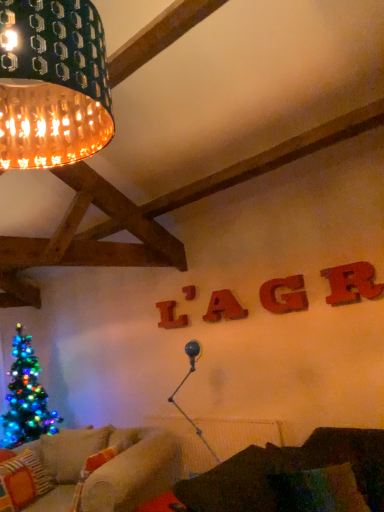
At what (x,y) coordinates should I click in order to perform the action: click on velvet red letter g at center, which is the fourth letter from back to front. Please return your answer as a coordinate pair (x, y). This screenshot has height=512, width=384. Looking at the image, I should click on (284, 295).

Image resolution: width=384 pixels, height=512 pixels. What do you see at coordinates (189, 292) in the screenshot?
I see `wooden letter at upper center, the fourth letter in the front-to-back sequence` at bounding box center [189, 292].

Where is `knitted wool pillow at lower left`? This screenshot has height=512, width=384. knitted wool pillow at lower left is located at coordinates (24, 479).

Image resolution: width=384 pixels, height=512 pixels. In order to click on matte gold lampshade at upper left in this screenshot , I will do `click(52, 83)`.

Identify the location of velvet dark brown couch at lower right. (290, 478).

In order to face wooden letter at center, which appears as the fifth letter when viewed from the right, should I rotate leftwards or rightwards?

→ You should rotate left by 2.874 degrees.

Measure the distance between point (363, 297) and camera.

They are 2.56 meters apart.

I want to click on velvet red letter g at center, arranged as the 2th letter when viewed from the front, so click(x=284, y=295).

From the image's perspective, starting from the knitted wool pillow at lower left, which letter is the 5th one above? Please provide its 2D coordinates.

[(352, 283)]

How many degrees apart are the facing directions of wooden letter at upper right, acting as the 5th letter starting from the back, and knitted wool pillow at lower left?

The angular difference between wooden letter at upper right, acting as the 5th letter starting from the back, and knitted wool pillow at lower left is 101 degrees.

Is wooden letter at upper right, acting as the 1th letter starting from the right, at the right side of knitted wool pillow at lower left?

Correct, you'll find wooden letter at upper right, acting as the 1th letter starting from the right, to the right of knitted wool pillow at lower left.

From a real-world perspective, is wooden letter at upper right, positioned as the fifth letter in left-to-right order, beneath knitted wool pillow at lower left?

No, from a real-world perspective, wooden letter at upper right, positioned as the fifth letter in left-to-right order, is not below knitted wool pillow at lower left.

Which object is further away from the camera, wooden letter at upper right, the first letter in the front-to-back sequence, or wooden letter at center, the 1th letter viewed from the left?

wooden letter at center, the 1th letter viewed from the left, is further away from the camera.

Looking at this image, which of these two, wooden letter at upper right, the first letter in the front-to-back sequence, or wooden letter at center, the 1th letter viewed from the back, is thinner?

With smaller width is wooden letter at center, the 1th letter viewed from the back.

Is wooden letter at upper right, acting as the 5th letter starting from the back, taller or shorter than wooden letter at center, the fifth letter viewed from the front?

In the image, wooden letter at upper right, acting as the 5th letter starting from the back, appears to be shorter than wooden letter at center, the fifth letter viewed from the front.

Is the surface of wooden letter at upper right, acting as the 1th letter starting from the right, in direct contact with wooden letter at center, the fifth letter viewed from the front?

No, wooden letter at upper right, acting as the 1th letter starting from the right, is not with wooden letter at center, the fifth letter viewed from the front.

Image resolution: width=384 pixels, height=512 pixels. I want to click on the 2nd letter positioned below the matte gold lampshade at upper left (from the image's perspective), so click(284, 295).

Visually, is velvet red letter g at center, which is the fourth letter from back to front, positioned to the left or to the right of matte gold lampshade at upper left?

velvet red letter g at center, which is the fourth letter from back to front, is to the right of matte gold lampshade at upper left.

Is velvet red letter g at center, which is the fourth letter from back to front, bigger than matte gold lampshade at upper left?

Incorrect, velvet red letter g at center, which is the fourth letter from back to front, is not larger than matte gold lampshade at upper left.

From a real-world perspective, which object rests below the other?

velvet red letter g at center, placed as the second letter when sorted from right to left, from a real-world perspective.

Can you confirm if velvet dark brown couch at lower right is shorter than wooden letter at upper center, marked as the 3th letter in a front-to-back arrangement?

Incorrect, the height of velvet dark brown couch at lower right does not fall short of that of wooden letter at upper center, marked as the 3th letter in a front-to-back arrangement.

Is point (361, 435) farther from camera compared to point (211, 297)?

No.

Find the location of `letter that is the 3rd one when counting backward from the velvet dark brown couch at lower right`. letter that is the 3rd one when counting backward from the velvet dark brown couch at lower right is located at coordinates (224, 307).

From the picture: Which object is positioned more to the right, velvet dark brown couch at lower right or wooden letter at upper center, the 3th letter positioned from the left?

From the viewer's perspective, velvet dark brown couch at lower right appears more on the right side.

Is wooden letter at upper center, the fourth letter in the front-to-back sequence, taller than velvet dark brown couch at lower right?

In fact, wooden letter at upper center, the fourth letter in the front-to-back sequence, may be shorter than velvet dark brown couch at lower right.

Which is nearer, (191, 293) or (194, 509)?

Point (194, 509)

Which object is closer to the camera taking this photo, wooden letter at upper center, which is counted as the 4th letter, starting from the right, or velvet dark brown couch at lower right?

velvet dark brown couch at lower right.

Looking at this image, could velvet dark brown couch at lower right be considered to be inside wooden letter at upper center, the second letter from the left?

No.

From a real-world perspective, which letter is the 5th one above the knitted wool pillow at lower left? Please provide its 2D coordinates.

[(189, 292)]

Could you tell me if knitted wool pillow at lower left is turned towards wooden letter at upper center, which appears as the 2th letter when viewed from the back?

No, knitted wool pillow at lower left is not aimed at wooden letter at upper center, which appears as the 2th letter when viewed from the back.

Can you confirm if knitted wool pillow at lower left is shorter than wooden letter at upper center, the second letter from the left?

In fact, knitted wool pillow at lower left may be taller than wooden letter at upper center, the second letter from the left.

Considering the sizes of knitted wool pillow at lower left and wooden letter at upper center, the fourth letter in the front-to-back sequence, in the image, is knitted wool pillow at lower left bigger or smaller than wooden letter at upper center, the fourth letter in the front-to-back sequence,?

Clearly, knitted wool pillow at lower left is larger in size than wooden letter at upper center, the fourth letter in the front-to-back sequence.

Is wooden letter at upper center, placed as the 3th letter when sorted from right to left, facing towards velvet red letter g at center, which is the fourth letter from back to front?

No.

You are a GUI agent. You are given a task and a screenshot of the screen. Output one action in this format:
    pyautogui.click(x=<x>, y=<y>)
    Task: Click on the letter that is the 1st object located in front of the wooden letter at upper center, the 3th letter positioned from the left
    
    Given the screenshot: What is the action you would take?
    pyautogui.click(x=284, y=295)

Looking at this image, is wooden letter at upper center, which is the third letter from back to front, far from velvet red letter g at center, arranged as the 2th letter when viewed from the front?

No, there isn't a large distance between wooden letter at upper center, which is the third letter from back to front, and velvet red letter g at center, arranged as the 2th letter when viewed from the front.

Identify the location of pillow to the left of wooden letter at upper right, acting as the 1th letter starting from the right. (24, 479).

Locate an element on the screen. the 4th letter in front when counting from the wooden letter at center, the fifth letter viewed from the front is located at coordinates (352, 283).

Estimate the real-world distances between objects in this image. Which object is further from wooden letter at center, which appears as the fifth letter when viewed from the right, matte gold lampshade at upper left or knitted wool pillow at lower left?

matte gold lampshade at upper left.

When comparing their distances from velvet dark brown couch at lower right, does wooden letter at upper center, which appears as the 2th letter when viewed from the back, or wooden letter at upper center, the 3th letter positioned from the left, seem further?

wooden letter at upper center, which appears as the 2th letter when viewed from the back, is positioned further to the anchor velvet dark brown couch at lower right.

When comparing their distances from velvet dark brown couch at lower right, does wooden letter at upper right, the first letter in the front-to-back sequence, or wooden letter at upper center, which is the third letter from back to front, seem closer?

wooden letter at upper right, the first letter in the front-to-back sequence, is positioned closer to the anchor velvet dark brown couch at lower right.

From the image, which object appears to be nearer to wooden letter at center, which appears as the fifth letter when viewed from the right, knitted wool pillow at lower left or wooden letter at upper center, which is counted as the 4th letter, starting from the right?

wooden letter at upper center, which is counted as the 4th letter, starting from the right.

Which object lies further to the anchor point velvet red letter g at center, which is the fourth letter from back to front, wooden letter at upper right, acting as the 1th letter starting from the right, or wooden letter at upper center, which is the third letter from back to front?

wooden letter at upper center, which is the third letter from back to front, lies further to velvet red letter g at center, which is the fourth letter from back to front, than the other object.

From the image, which object appears to be farther from wooden letter at upper right, positioned as the fifth letter in left-to-right order, wooden letter at center, the 1th letter viewed from the left, or velvet dark brown couch at lower right?

wooden letter at center, the 1th letter viewed from the left.

Which object lies nearer to the anchor point velvet red letter g at center, placed as the second letter when sorted from right to left, wooden letter at upper center, which is counted as the 4th letter, starting from the right, or wooden letter at center, the 1th letter viewed from the back?

wooden letter at upper center, which is counted as the 4th letter, starting from the right.

Looking at the image, which one is located closer to wooden letter at upper center, the fourth letter in the front-to-back sequence, velvet red letter g at center, arranged as the 2th letter when viewed from the front, or matte gold lampshade at upper left?

Among the two, velvet red letter g at center, arranged as the 2th letter when viewed from the front, is located nearer to wooden letter at upper center, the fourth letter in the front-to-back sequence.

The image size is (384, 512). I want to click on couch between matte gold lampshade at upper left and wooden letter at upper center, placed as the 3th letter when sorted from right to left, from front to back, so click(290, 478).

Image resolution: width=384 pixels, height=512 pixels. I want to click on pillow between matte gold lampshade at upper left and wooden letter at upper center, the second letter from the left, in the front-back direction, so click(24, 479).

In order to click on couch between matte gold lampshade at upper left and knitted wool pillow at lower left in the vertical direction in this screenshot , I will do `click(290, 478)`.

You are a GUI agent. You are given a task and a screenshot of the screen. Output one action in this format:
    pyautogui.click(x=<x>, y=<y>)
    Task: Click on the couch located between matte gold lampshade at upper left and wooden letter at center, the fifth letter viewed from the front, in the depth direction
    
    Given the screenshot: What is the action you would take?
    pyautogui.click(x=290, y=478)